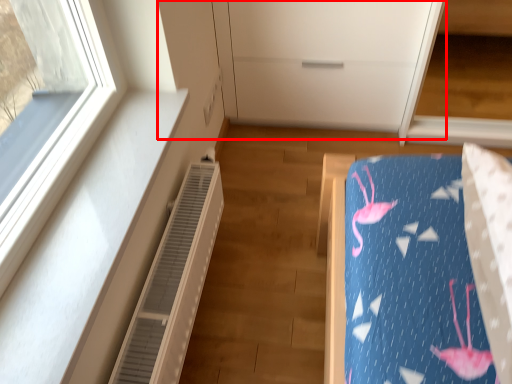
Question: Where is dresser (annotated by the red box) located in relation to air conditioner in the image?

Choices:
 (A) left
 (B) right

Answer: (B)